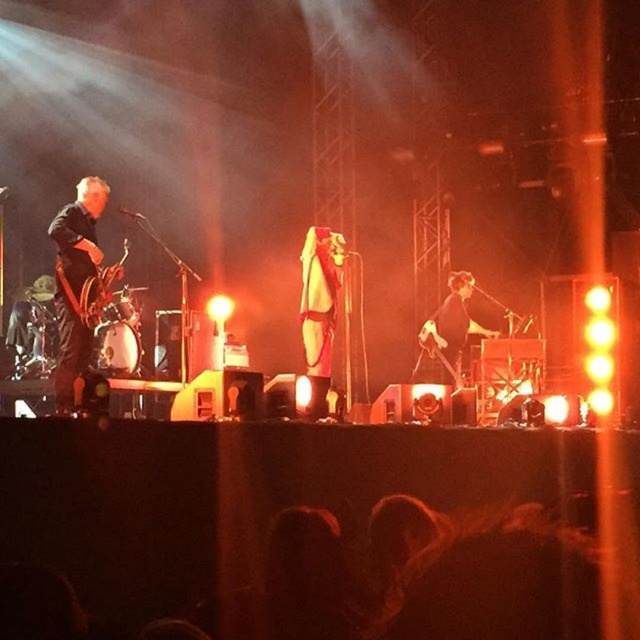
Question: Which of these objects is positioned closest to the white matte mask at center?

Choices:
 (A) dark blue leather jacket at left
 (B) black matte guitar at center

Answer: (A)

Question: Is dark blue leather jacket at left below white matte mask at center?

Choices:
 (A) yes
 (B) no

Answer: (A)

Question: Which object is farther from the camera taking this photo?

Choices:
 (A) black matte guitar at center
 (B) white matte mask at center
 (C) dark blue leather jacket at left

Answer: (A)

Question: Is white matte mask at center to the right of black matte guitar at center from the viewer's perspective?

Choices:
 (A) yes
 (B) no

Answer: (B)

Question: Is dark blue leather jacket at left above black matte guitar at center?

Choices:
 (A) yes
 (B) no

Answer: (A)

Question: Which is nearer to the white matte mask at center?

Choices:
 (A) black matte guitar at center
 (B) dark blue leather jacket at left

Answer: (B)